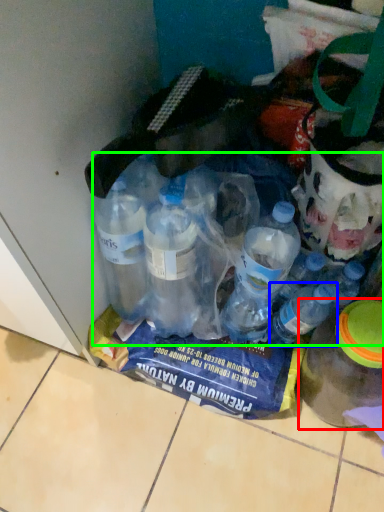
Question: Considering the real-world distances, which object is closest to bottle (highlighted by a red box)? bottle (highlighted by a blue box) or bottle (highlighted by a green box).

Choices:
 (A) bottle
 (B) bottle

Answer: (A)